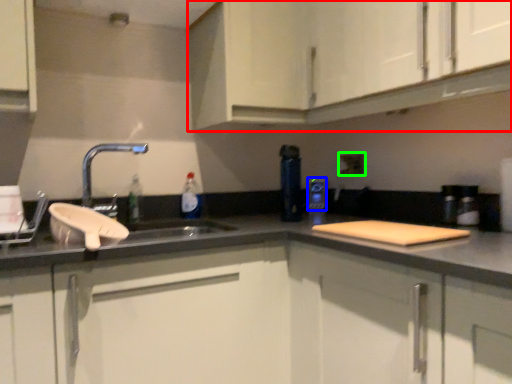
Question: Which is farther away from cabinetry (highlighted by a red box)? appliance (highlighted by a blue box) or electric outlet (highlighted by a green box)?

Choices:
 (A) appliance
 (B) electric outlet

Answer: (A)